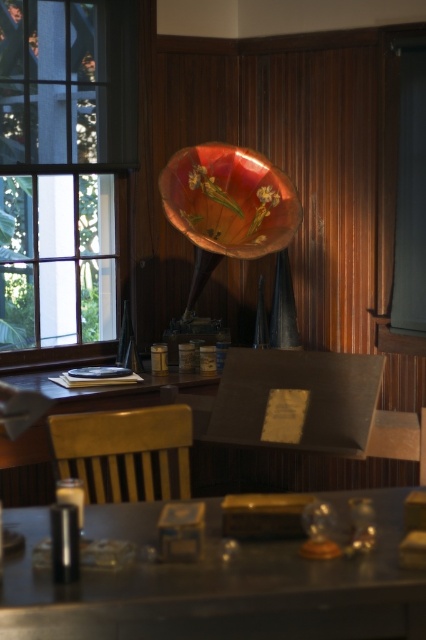
You are standing in the vintage room and want to place a small potted plant on the metallic silver table at center. However, you need to ensure that the plant will receive sunlight. Given the clear glass window at left, will the plant get enough sunlight if placed there?

The clear glass window at left is positioned over the metallic silver table at center, meaning sunlight from the window will directly illuminate the table. Therefore, placing the plant there will ensure it receives adequate sunlight.

From the picture: You are an interior designer planning to place a new sofa in this vintage room. You need to know which object, the clear glass window at left or the metallic silver table at center, has a greater width to determine the best placement. Which one is wider?

The clear glass window at left is wider than the metallic silver table at center according to the description.

You are a guest in this vintage room and want to place a small vase on the metallic silver table at center. However, you are concerned about the height of the table compared to the wooden chair at center. Can you confirm if the table is tall enough to prevent the vase from being hidden by the chair?

The metallic silver table at center is shorter than the wooden chair at center. Therefore, placing the vase on the table may result in it being obscured by the chair due to the table being lower in height.